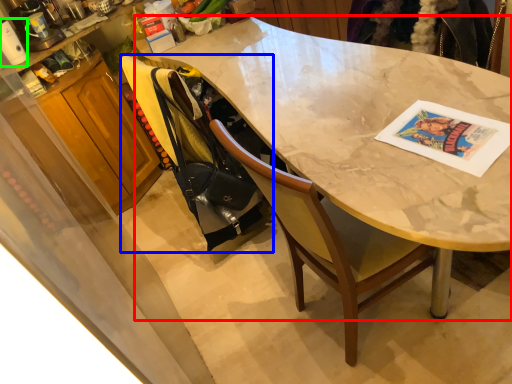
Question: Which object is the farthest from desk (highlighted by a red box)? Choose among these: handbag (highlighted by a blue box) or appliance (highlighted by a green box).

Choices:
 (A) handbag
 (B) appliance

Answer: (B)